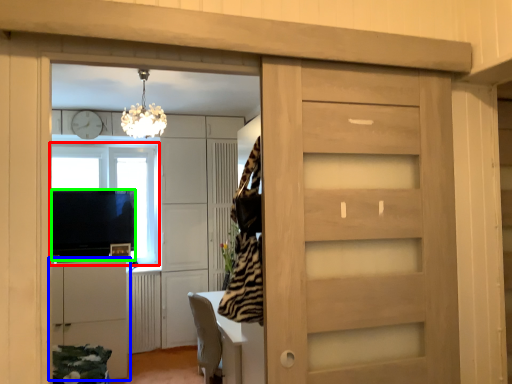
Question: Estimate the real-world distances between objects in this image. Which object is farther from window (highlighted by a red box), cabinetry (highlighted by a blue box) or appliance (highlighted by a green box)?

Choices:
 (A) cabinetry
 (B) appliance

Answer: (A)